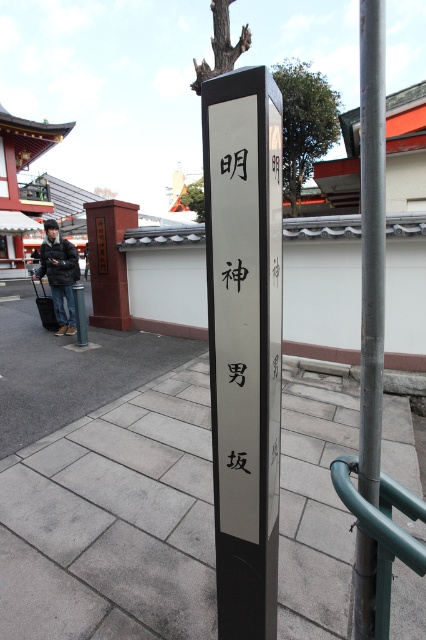
You are a visitor at a Japanese shrine and need to find the main entrance. You see a brick signpost at center and a matte black signpost at lower left. Which signpost is taller and likely indicates the main path?

The brick signpost at center is much taller than the matte black signpost at lower left, so it likely indicates the main path.

You are a tourist in a traditional Japanese setting and see the brick signpost at center and the matte black signpost at lower left. Which signpost is closer to you?

The brick signpost at center is positioned over the matte black signpost at lower left, meaning the brick signpost at center is closer to you.